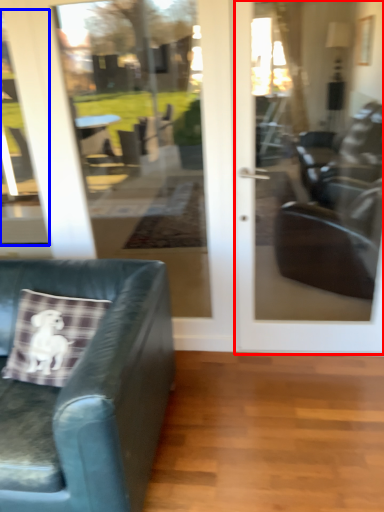
Question: Which point is closer to the camera, door (highlighted by a red box) or window (highlighted by a blue box)?

Choices:
 (A) door
 (B) window

Answer: (A)